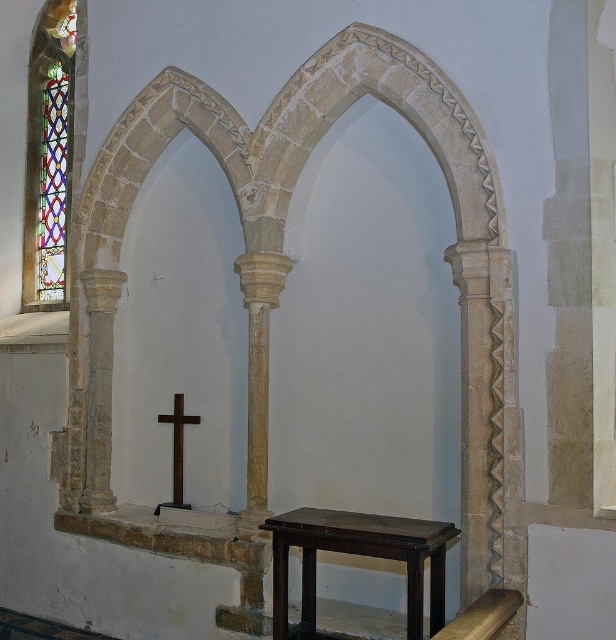
Question: Does stained glass window at left appear over dark brown wooden table at center?

Choices:
 (A) no
 (B) yes

Answer: (B)

Question: Does stained glass window at left come behind multicolored stained glass at left?

Choices:
 (A) yes
 (B) no

Answer: (B)

Question: In this image, where is dark brown wooden table at center located relative to multicolored stained glass at left?

Choices:
 (A) above
 (B) below

Answer: (B)

Question: Estimate the real-world distances between objects in this image. Which object is farther from the stained glass window at left?

Choices:
 (A) dark brown wooden table at center
 (B) dark brown wooden cross at center
 (C) multicolored stained glass at left

Answer: (A)

Question: Which object appears closest to the camera in this image?

Choices:
 (A) dark brown wooden table at center
 (B) dark brown wooden cross at center
 (C) stained glass window at left

Answer: (A)

Question: Which point appears closest to the camera in this image?

Choices:
 (A) (30, 305)
 (B) (176, 499)

Answer: (B)